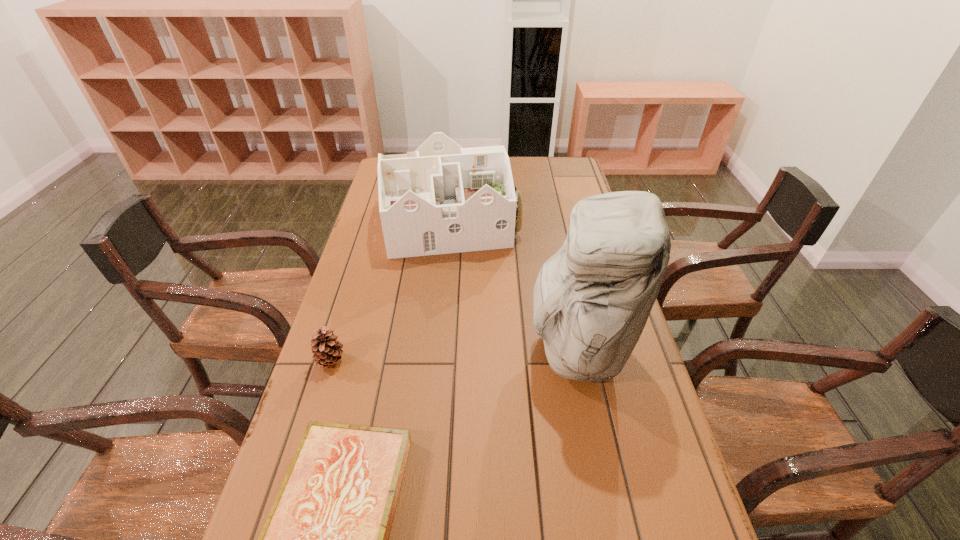
In order to click on the tallest object in this screenshot , I will do `click(591, 301)`.

Image resolution: width=960 pixels, height=540 pixels. Identify the location of the second tallest object. [442, 198].

The width and height of the screenshot is (960, 540). Identify the location of dollhouse. (442, 198).

Where is `the third tallest object`? the third tallest object is located at coordinates (326, 350).

What are the coordinates of `vacant area located 0.320m on the front-facing side of the tallest object` in the screenshot? It's located at (400, 349).

The height and width of the screenshot is (540, 960). I want to click on vacant space located on the front-facing side of the tallest object, so click(x=385, y=349).

Where is `free space located 0.380m on the front-facing side of the tallest object`? This screenshot has width=960, height=540. free space located 0.380m on the front-facing side of the tallest object is located at coordinates (377, 349).

Locate an element on the screen. Image resolution: width=960 pixels, height=540 pixels. vacant space situated 0.200m on the right of the dollhouse is located at coordinates (577, 222).

Identify the location of vacant space located 0.260m on the back of the third tallest object. (356, 281).

Where is `dollhouse at the left edge`? Image resolution: width=960 pixels, height=540 pixels. dollhouse at the left edge is located at coordinates (442, 198).